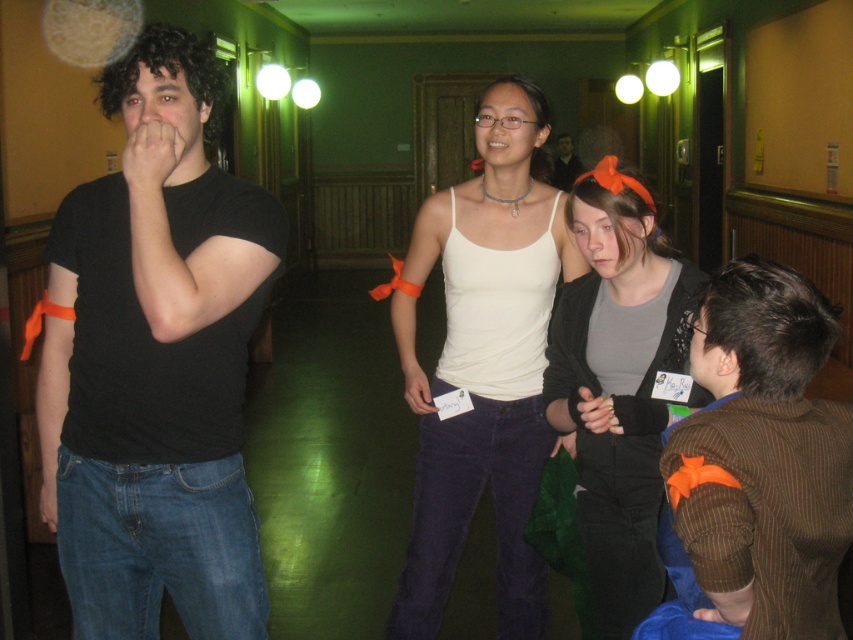
Can you confirm if white cotton tank top at center is positioned to the left of brown pinstripe sweater at lower right?

Correct, you'll find white cotton tank top at center to the left of brown pinstripe sweater at lower right.

Is white cotton tank top at center shorter than brown pinstripe sweater at lower right?

In fact, white cotton tank top at center may be taller than brown pinstripe sweater at lower right.

Identify the location of white cotton tank top at center. This screenshot has height=640, width=853. coord(485,362).

Does brown pinstripe sweater at lower right come in front of matte black shirt at center?

Yes, brown pinstripe sweater at lower right is in front of matte black shirt at center.

Does brown pinstripe sweater at lower right appear on the left side of matte black shirt at center?

Correct, you'll find brown pinstripe sweater at lower right to the left of matte black shirt at center.

What do you see at coordinates (763, 458) in the screenshot? This screenshot has width=853, height=640. I see `brown pinstripe sweater at lower right` at bounding box center [763, 458].

Identify the location of brown pinstripe sweater at lower right. (763, 458).

Is white cotton tank top at center thinner than matte black shirt at center?

In fact, white cotton tank top at center might be wider than matte black shirt at center.

Which of these two, white cotton tank top at center or matte black shirt at center, stands shorter?

With less height is matte black shirt at center.

Who is more distant from viewer, (450, 234) or (563, 141)?

Positioned behind is point (563, 141).

Image resolution: width=853 pixels, height=640 pixels. Identify the location of white cotton tank top at center. (485, 362).